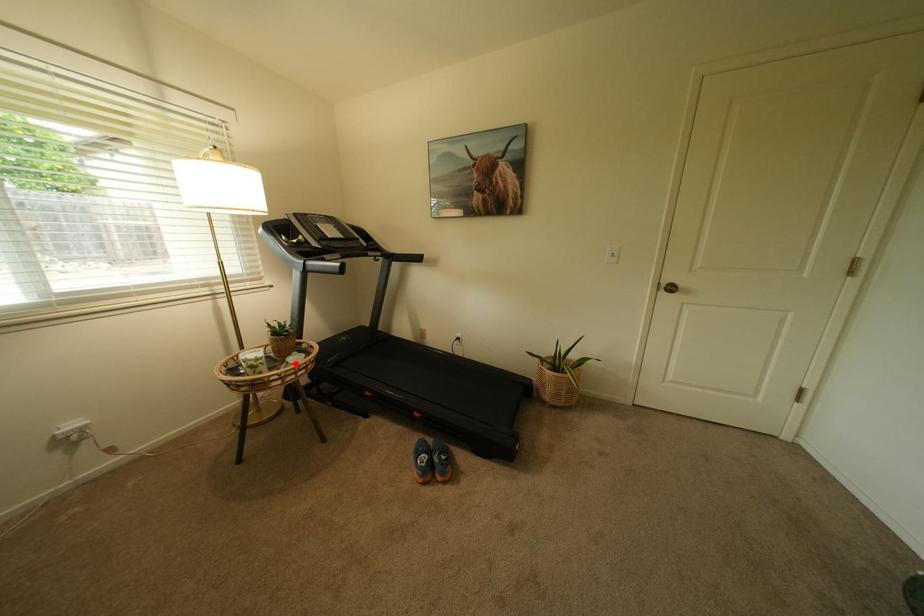
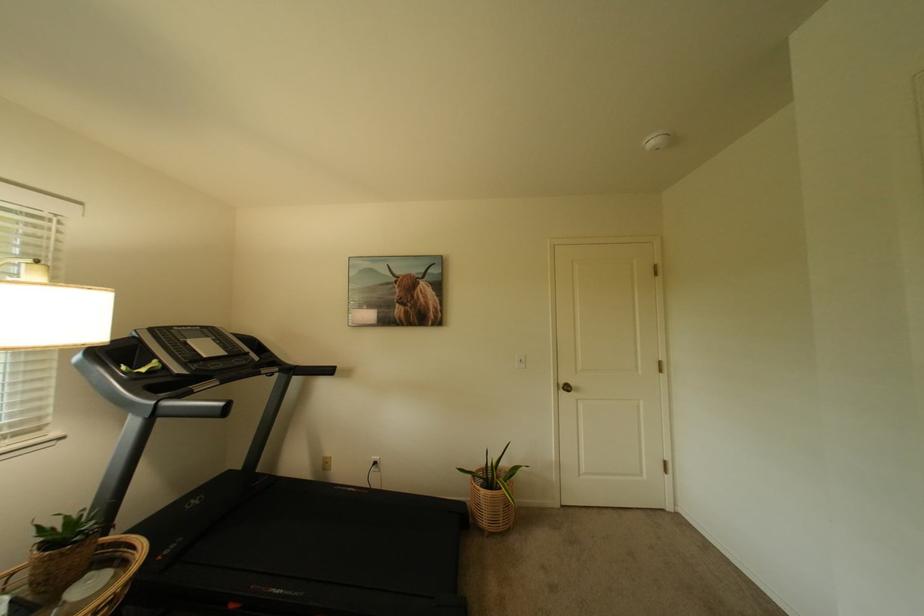
Question: A red point is marked in image1. In image2, is the corresponding 3D point closer to the camera or farther? Reply with the corresponding letter.

Choices:
 (A) The corresponding 3D point is closer.
 (B) The corresponding 3D point is farther.

Answer: (A)